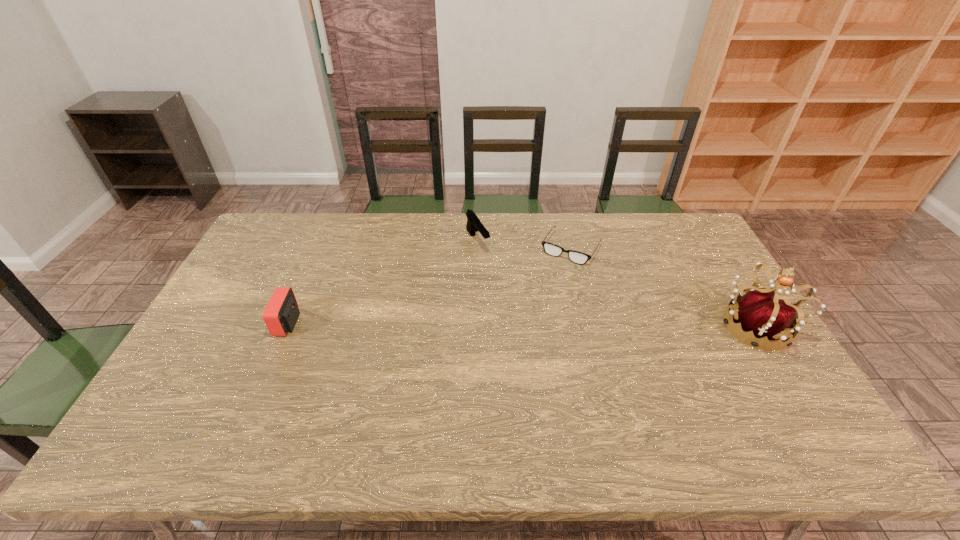
You are a GUI agent. You are given a task and a screenshot of the screen. Output one action in this format:
    pyautogui.click(x=<x>, y=<y>)
    Task: Click on the free spot on the desktop that is between the leftmost object and the tallest object and is positioned on the front-facing side of the shortest object
    
    Given the screenshot: What is the action you would take?
    pyautogui.click(x=524, y=325)

This screenshot has height=540, width=960. I want to click on free space on the desktop that is between the leftmost object and the tallest object and is positioned on the front-facing side of the third object from right to left, so click(x=539, y=325).